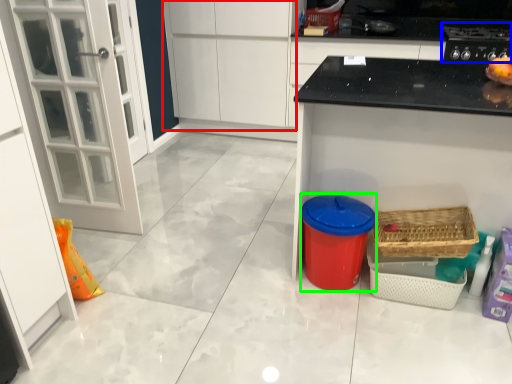
Question: Estimate the real-world distances between objects in this image. Which object is closer to cabinetry (highlighted by a red box), appliance (highlighted by a blue box) or appliance (highlighted by a green box)?

Choices:
 (A) appliance
 (B) appliance

Answer: (A)